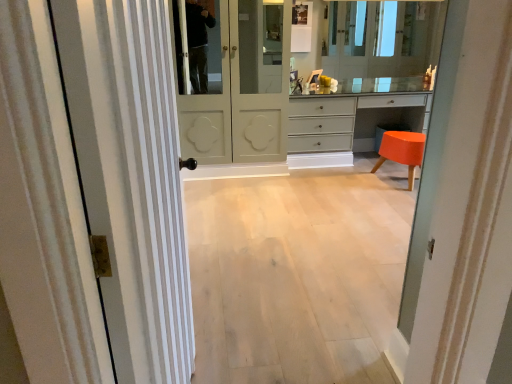
Question: From a real-world perspective, is white striped door at left, arranged as the 1th door when viewed from the left, physically located above or below orange glossy stool at lower right?

Choices:
 (A) above
 (B) below

Answer: (A)

Question: Considering the positions of white striped door at left, acting as the 2th door starting from the right, and orange glossy stool at lower right in the image, is white striped door at left, acting as the 2th door starting from the right, wider or thinner than orange glossy stool at lower right?

Choices:
 (A) wide
 (B) thin

Answer: (B)

Question: Considering the real-world distances, which object is closest to the matte gray chest of drawers at center?

Choices:
 (A) light wood floor at center
 (B) white striped door at left, acting as the 2th door starting from the right
 (C) clear glass mirror at upper center
 (D) matte white door at center, which is the second door from front to back
 (E) orange glossy stool at lower right

Answer: (E)

Question: Which object is the closest to the matte white door at center, which is the second door from front to back?

Choices:
 (A) white striped door at left, which is the second door from back to front
 (B) orange glossy stool at lower right
 (C) matte gray chest of drawers at center
 (D) clear glass mirror at upper center
 (E) light wood floor at center

Answer: (C)